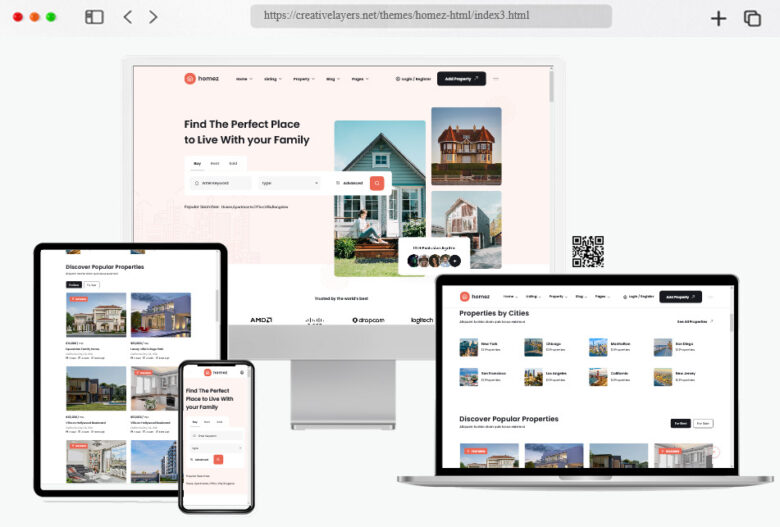
Locate an element on the screen. desktop is located at coordinates (341, 395).